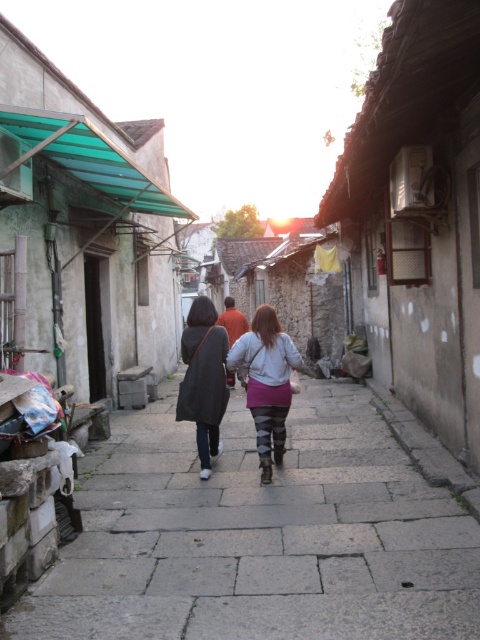
Question: Which object appears farthest from the camera in this image?

Choices:
 (A) gray fabric jacket at center
 (B) dark gray coat at center
 (C) gray stone pavement at center

Answer: (B)

Question: Does gray fabric jacket at center appear under dark gray coat at center?

Choices:
 (A) yes
 (B) no

Answer: (B)

Question: Is gray fabric jacket at center smaller than dark gray coat at center?

Choices:
 (A) yes
 (B) no

Answer: (B)

Question: Which object appears farthest from the camera in this image?

Choices:
 (A) gray stone pavement at center
 (B) gray fabric jacket at center

Answer: (B)

Question: Does gray stone pavement at center have a lesser width compared to gray fabric jacket at center?

Choices:
 (A) yes
 (B) no

Answer: (B)

Question: Which object is closer to the camera taking this photo?

Choices:
 (A) dark gray coat at center
 (B) gray stone pavement at center
 (C) gray fabric jacket at center

Answer: (B)